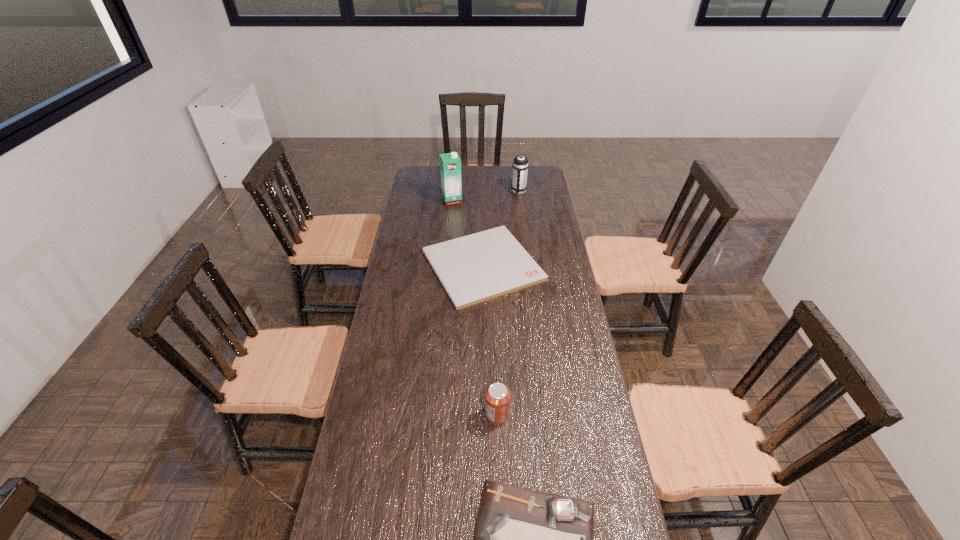
This screenshot has width=960, height=540. In order to click on object that is at the left edge in this screenshot , I will do `click(475, 268)`.

Identify the location of thermos bottle present at the right edge. (520, 165).

You are a GUI agent. You are given a task and a screenshot of the screen. Output one action in this format:
    pyautogui.click(x=<x>, y=<y>)
    Task: Click on the clipboard at the right edge
    Image resolution: width=960 pixels, height=540 pixels.
    Given the screenshot: What is the action you would take?
    click(475, 268)

Find the location of a particular element. object located in the far right corner section of the desktop is located at coordinates (520, 165).

Locate an element on the screen. The width and height of the screenshot is (960, 540). free space at the far edge of the desktop is located at coordinates (483, 177).

Identify the location of vacant space at the left edge. The height and width of the screenshot is (540, 960). (406, 376).

Find the location of a particular element. free location at the right edge is located at coordinates (560, 296).

I want to click on vacant space that is in between the thermos bottle and the third shortest object, so click(x=508, y=303).

At what (x,y) coordinates should I click in order to perform the action: click on free space that is in between the can and the fourth shortest object. Please return your answer as a coordinate pair (x, y). Looking at the image, I should click on (508, 303).

Where is `empty location between the second nearest object and the tallest object`? The width and height of the screenshot is (960, 540). empty location between the second nearest object and the tallest object is located at coordinates (474, 308).